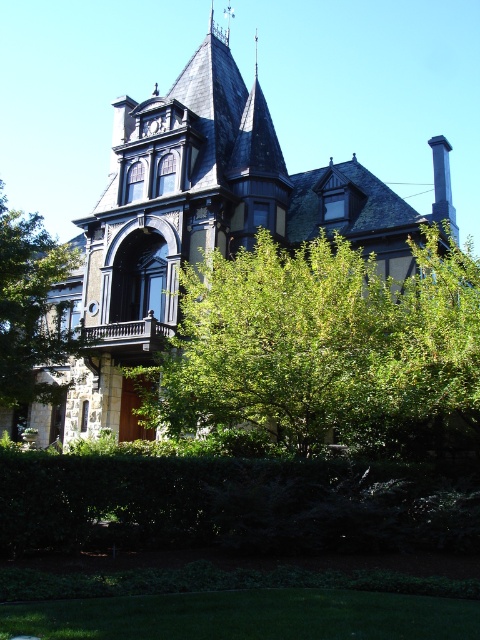
Who is more distant from viewer, (x=224, y=484) or (x=64, y=385)?

The point (x=64, y=385) is behind.

Is green leafy hedge at lower center further to camera compared to green leafy tree at lower left?

No.

Does point (321, 465) come closer to viewer compared to point (6, 316)?

Yes, point (321, 465) is closer to viewer.

This screenshot has width=480, height=640. Identify the location of green leafy hedge at lower center. (230, 504).

Does point (312, 332) come closer to viewer compared to point (14, 269)?

Yes, point (312, 332) is in front of point (14, 269).

What do you see at coordinates (324, 349) in the screenshot? I see `green leafy tree at center` at bounding box center [324, 349].

In order to click on green leafy tree at center in this screenshot , I will do `click(324, 349)`.

Find the location of `green leafy tree at center`. green leafy tree at center is located at coordinates (324, 349).

Between dark gray stone mansion at center and green leafy tree at center, which one is positioned lower?

green leafy tree at center

Between dark gray stone mansion at center and green leafy tree at center, which one has more height?

dark gray stone mansion at center

Is point (288, 221) closer to viewer compared to point (428, 237)?

No, (288, 221) is further to viewer.

Identify the location of dark gray stone mansion at center. The image size is (480, 640). (206, 218).